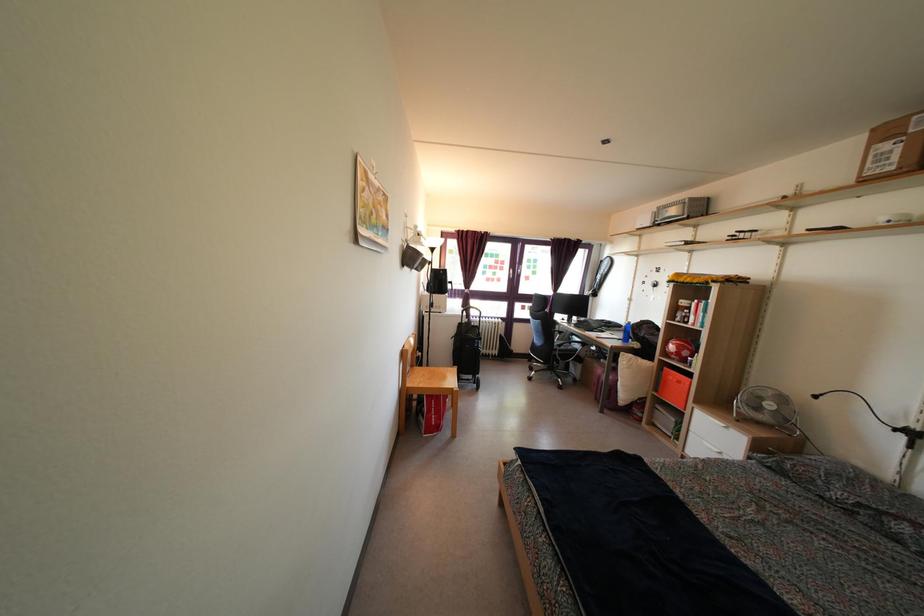
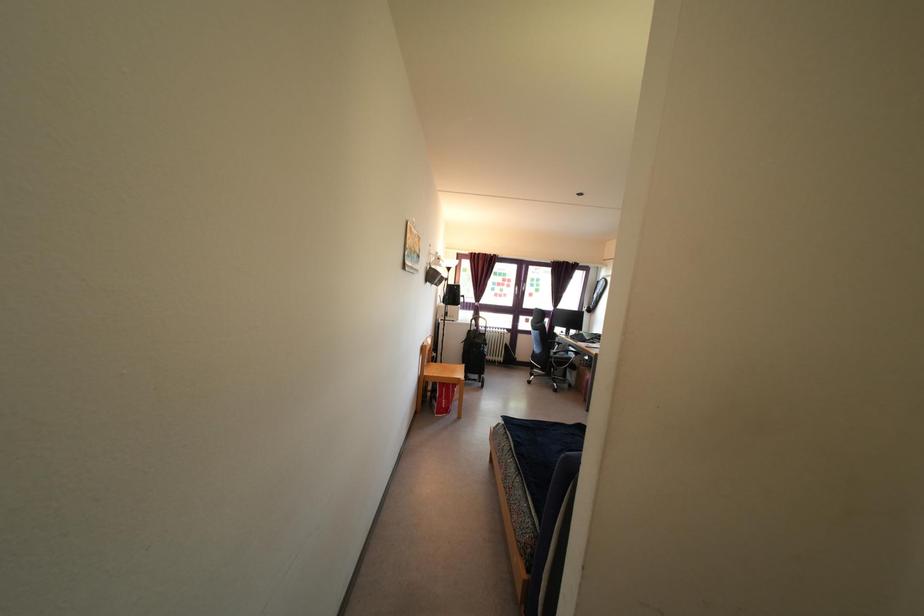
In the second image, find the point that corresponds to the point at 563,354 in the first image.

(557, 362)